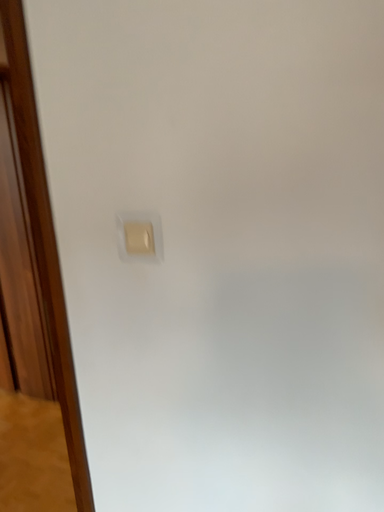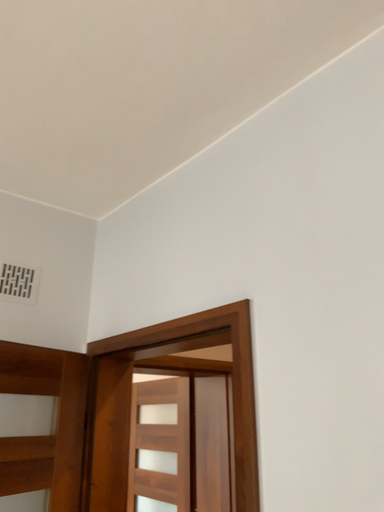
Question: Which way did the camera rotate in the video?

Choices:
 (A) rotated upward
 (B) rotated downward

Answer: (A)